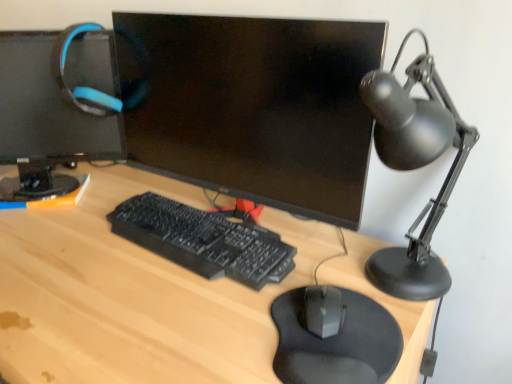
What are the coordinates of `free spot above black matte mousepad at lower center (from a real-world perspective)` in the screenshot? It's located at (324, 330).